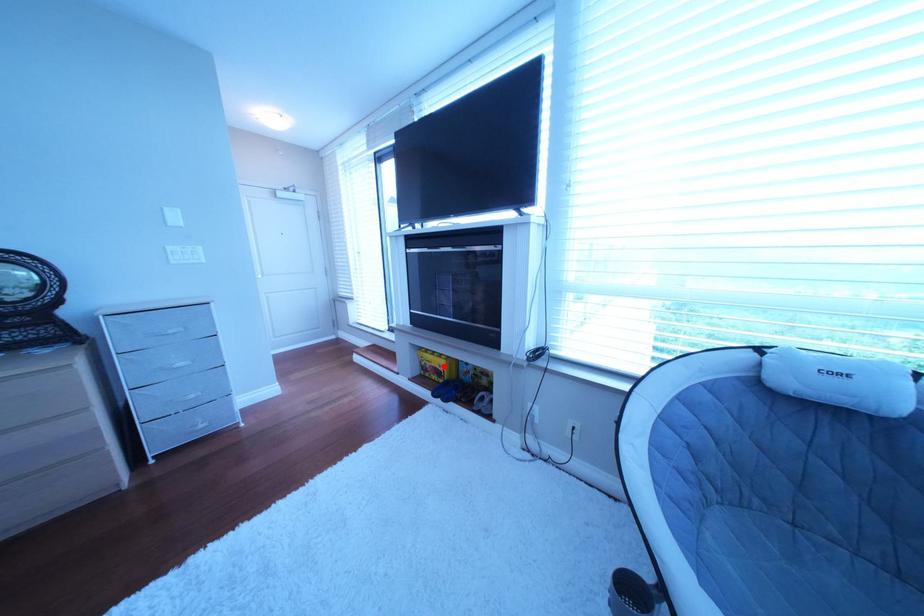
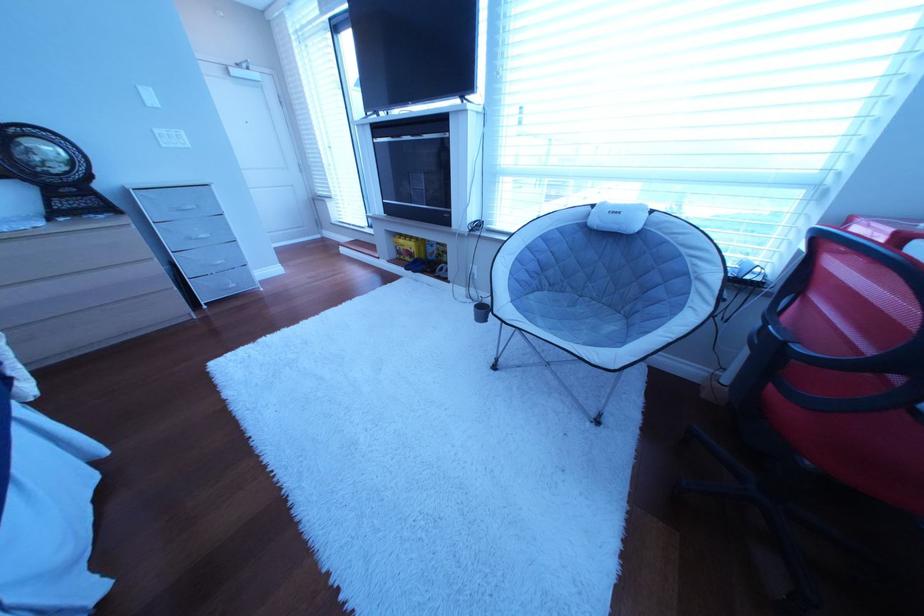
The point at the highlighted location is marked in the first image. Where is the corresponding point in the second image?

(418, 251)